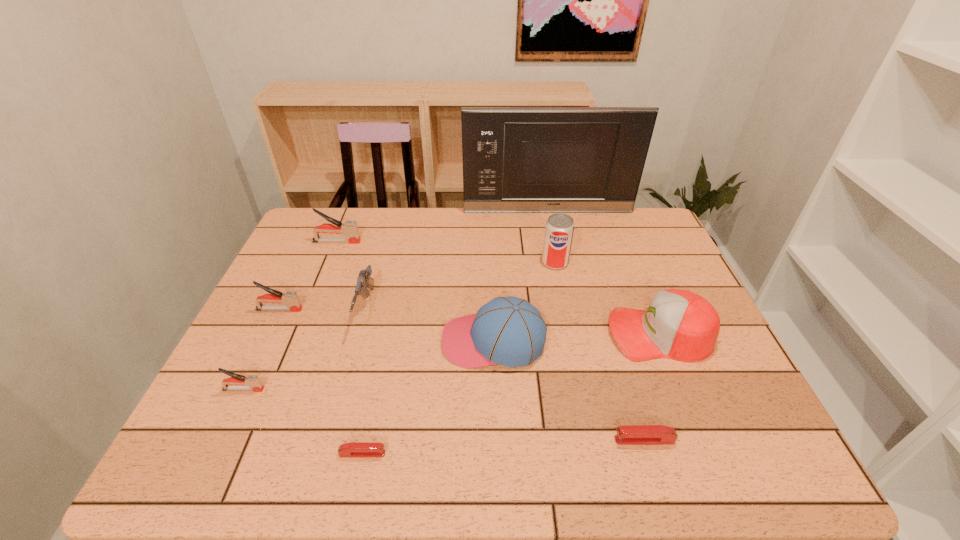
Where is `vacant region located on the front-facing side of the left baseball cap`? The width and height of the screenshot is (960, 540). vacant region located on the front-facing side of the left baseball cap is located at coordinates (390, 341).

You are a GUI agent. You are given a task and a screenshot of the screen. Output one action in this format:
    pyautogui.click(x=<x>, y=<y>)
    Task: Click on the vacant space located on the front-facing side of the left baseball cap
    
    Given the screenshot: What is the action you would take?
    pyautogui.click(x=358, y=341)

Find the location of a particular element. The height and width of the screenshot is (540, 960). free space located on the front-facing side of the left baseball cap is located at coordinates (338, 341).

Where is `vacant area situated on the front-facing side of the right baseball cap`? vacant area situated on the front-facing side of the right baseball cap is located at coordinates (562, 334).

I want to click on vacant space located on the front-facing side of the right baseball cap, so click(x=451, y=334).

Locate an element on the screen. vacant space located on the front-facing side of the right baseball cap is located at coordinates (470, 334).

Where is `free space located 0.130m at the barrel of the fourth object from left to right`? The height and width of the screenshot is (540, 960). free space located 0.130m at the barrel of the fourth object from left to right is located at coordinates (347, 384).

Identify the location of vacant position located 0.250m on the handle side of the second biggest gray stapler. (395, 309).

Where is `free space located 0.140m on the handle side of the third tallest stapler`? The height and width of the screenshot is (540, 960). free space located 0.140m on the handle side of the third tallest stapler is located at coordinates (325, 389).

You are a GUI agent. You are given a task and a screenshot of the screen. Output one action in this format:
    pyautogui.click(x=<x>, y=<y>)
    Task: Click on the free space located 0.280m on the front-facing side of the fourth farthest stapler
    
    Given the screenshot: What is the action you would take?
    pyautogui.click(x=478, y=440)